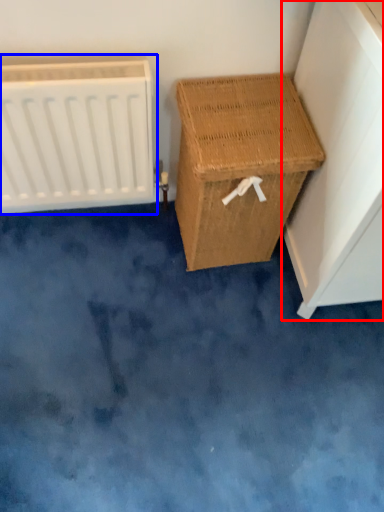
Question: Which point is further to the camera, furniture (highlighted by a red box) or radiator (highlighted by a blue box)?

Choices:
 (A) furniture
 (B) radiator

Answer: (B)